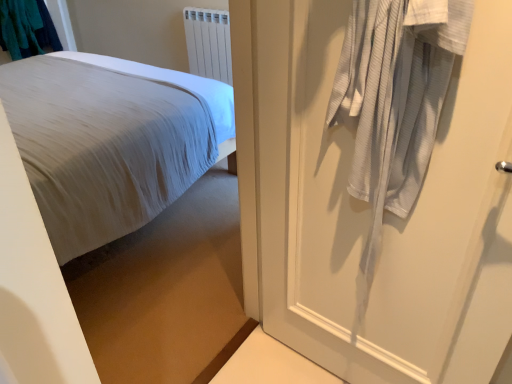
Question: Is white plastic radiator at upper center inside teal fabric laundry at upper left?

Choices:
 (A) no
 (B) yes

Answer: (A)

Question: Is teal fabric laundry at upper left positioned beyond the bounds of white plastic radiator at upper center?

Choices:
 (A) no
 (B) yes

Answer: (B)

Question: From the image's perspective, is teal fabric laundry at upper left on top of white plastic radiator at upper center?

Choices:
 (A) yes
 (B) no

Answer: (A)

Question: Does teal fabric laundry at upper left have a lesser width compared to white plastic radiator at upper center?

Choices:
 (A) no
 (B) yes

Answer: (A)

Question: Can you confirm if teal fabric laundry at upper left is smaller than white plastic radiator at upper center?

Choices:
 (A) no
 (B) yes

Answer: (A)

Question: Is teal fabric laundry at upper left oriented away from white plastic radiator at upper center?

Choices:
 (A) yes
 (B) no

Answer: (B)

Question: Does teal fabric laundry at upper left have a lesser width compared to white textured door at right?

Choices:
 (A) yes
 (B) no

Answer: (B)

Question: Is teal fabric laundry at upper left with white textured door at right?

Choices:
 (A) no
 (B) yes

Answer: (A)

Question: Is teal fabric laundry at upper left to the right of white textured door at right from the viewer's perspective?

Choices:
 (A) no
 (B) yes

Answer: (A)

Question: Can you confirm if teal fabric laundry at upper left is bigger than white textured door at right?

Choices:
 (A) yes
 (B) no

Answer: (B)

Question: Is teal fabric laundry at upper left to the left of white textured door at right from the viewer's perspective?

Choices:
 (A) yes
 (B) no

Answer: (A)

Question: From a real-world perspective, is teal fabric laundry at upper left positioned under white textured door at right based on gravity?

Choices:
 (A) yes
 (B) no

Answer: (B)

Question: From a real-world perspective, is teal fabric laundry at upper left over white cotton bed at left?

Choices:
 (A) yes
 (B) no

Answer: (A)